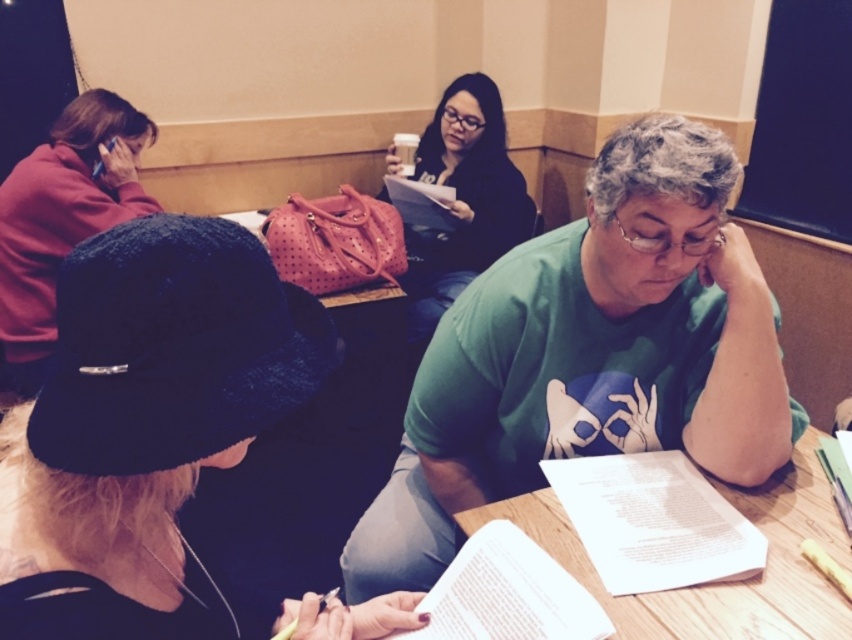
You are standing at the entrance of the room and want to place a small potted plant on the wooden table at center. The coordinates of the table are given as point (x=718, y=582). Can you confirm if this point is on the table?

Yes, the point (x=718, y=582) is on the wooden table at center, so placing the potted plant there would be appropriate.

You are standing in the room and want to hand a book to the person wearing the matte red hoodie at upper left. Which direction should you move to reach them first, considering their position relative to the matte black shirt at center?

The matte red hoodie at upper left is positioned under the matte black shirt at center, so you should move downward to reach the person wearing the matte red hoodie at upper left first.